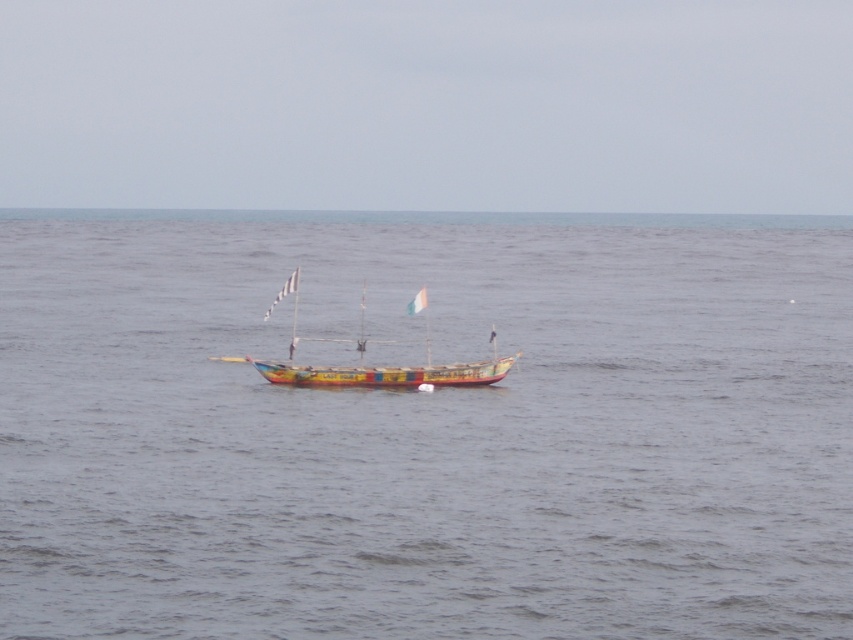
Question: Does smooth gray water at center appear on the right side of painted wooden boat at center?

Choices:
 (A) no
 (B) yes

Answer: (B)

Question: Can you confirm if smooth gray water at center is wider than painted wooden boat at center?

Choices:
 (A) no
 (B) yes

Answer: (B)

Question: Which point is closer to the camera?

Choices:
 (A) smooth gray water at center
 (B) painted wooden boat at center

Answer: (A)

Question: Where is smooth gray water at center located in relation to painted wooden boat at center in the image?

Choices:
 (A) right
 (B) left

Answer: (A)